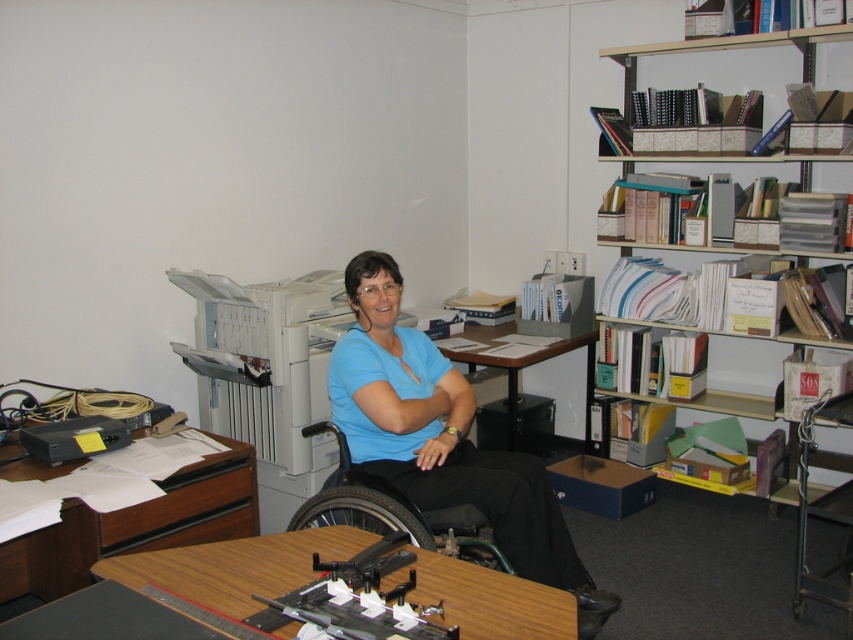
Can you confirm if blue cotton shirt at center is shorter than wooden table at center?

In fact, blue cotton shirt at center may be taller than wooden table at center.

Can you confirm if blue cotton shirt at center is positioned above wooden table at center?

Indeed, blue cotton shirt at center is positioned over wooden table at center.

Between point (506, 518) and point (173, 586), which one is positioned behind?

The point (506, 518) is more distant.

Locate an element on the screen. This screenshot has height=640, width=853. blue cotton shirt at center is located at coordinates (444, 438).

Locate an element on the screen. The image size is (853, 640). white plastic printer at center is located at coordinates (265, 360).

Which is more to the right, white plastic printer at center or white cardboard bookshelf at upper right?

white cardboard bookshelf at upper right

Is point (233, 321) closer to viewer compared to point (675, 42)?

Yes, it is.

The height and width of the screenshot is (640, 853). I want to click on white plastic printer at center, so click(265, 360).

Between white plastic printer at center and wooden table at center, which one has more height?

white plastic printer at center

Is point (288, 333) less distant than point (222, 608)?

No.

Is point (294, 403) positioned behind point (502, 602)?

Yes, it is.

You are a GUI agent. You are given a task and a screenshot of the screen. Output one action in this format:
    pyautogui.click(x=<x>, y=<y>)
    Task: Click on the white plastic printer at center
    
    Given the screenshot: What is the action you would take?
    pyautogui.click(x=265, y=360)